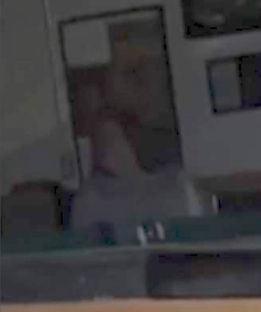
Locate an element on the screen. The height and width of the screenshot is (312, 261). door lintel is located at coordinates (123, 8).